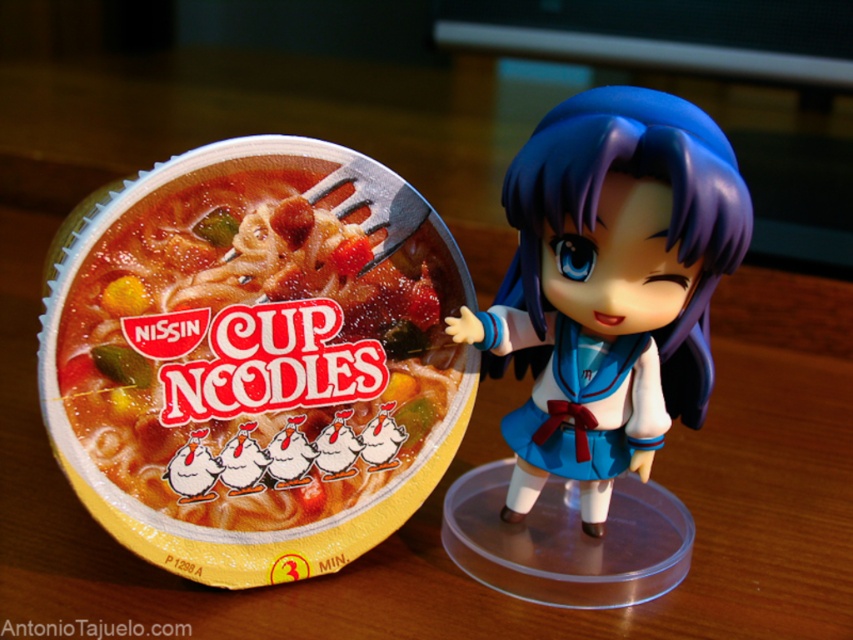
Question: Is matte plastic cup noodles at left smaller than satin blue doll at center?

Choices:
 (A) yes
 (B) no

Answer: (A)

Question: Which of the following is the farthest from the observer?

Choices:
 (A) matte plastic cup noodles at left
 (B) satin blue doll at center

Answer: (A)

Question: Where is matte plastic cup noodles at left located in relation to satin blue doll at center in the image?

Choices:
 (A) above
 (B) below

Answer: (B)

Question: Which object is closer to the camera taking this photo?

Choices:
 (A) satin blue doll at center
 (B) matte plastic cup noodles at left

Answer: (A)

Question: Which point is farther from the camera taking this photo?

Choices:
 (A) (347, 344)
 (B) (585, 115)

Answer: (A)

Question: Is matte plastic cup noodles at left positioned before satin blue doll at center?

Choices:
 (A) no
 (B) yes

Answer: (A)